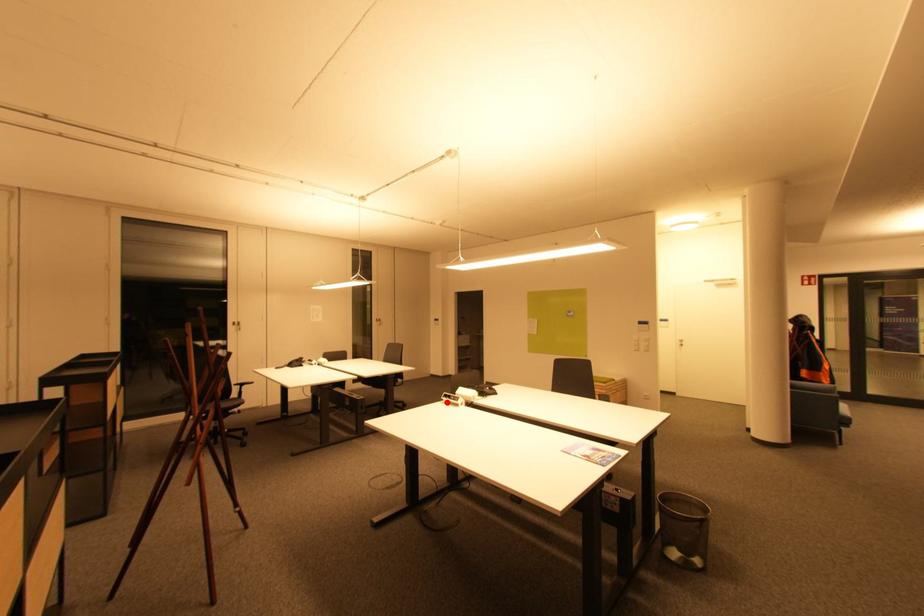
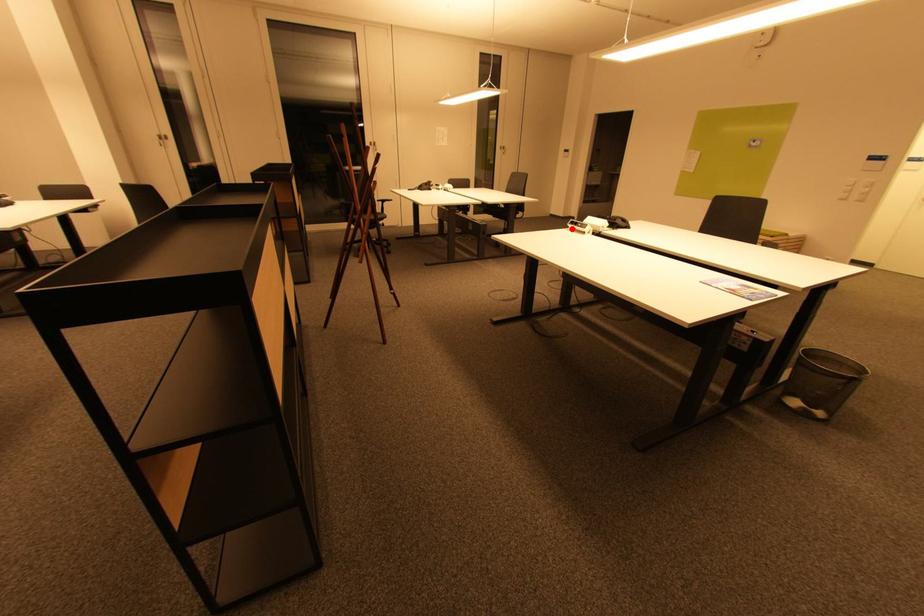
I am providing you with two images of the same scene from different viewpoints. A red point is marked on the first image and another point is marked on the second image. Is the red point in image1 aligned with the point shown in image2?

Yes